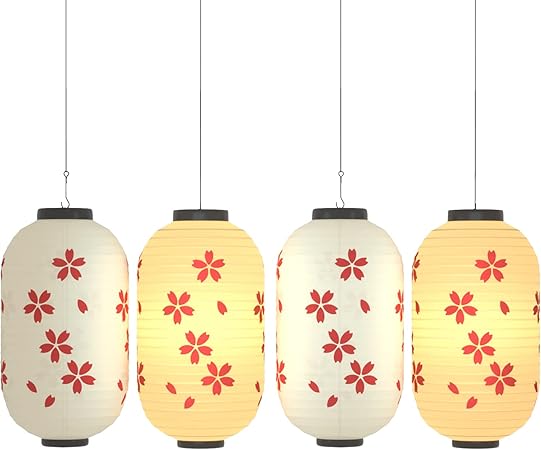
The height and width of the screenshot is (450, 541). In order to click on cable in this screenshot , I will do `click(65, 127)`, `click(201, 117)`, `click(341, 110)`, `click(473, 107)`.